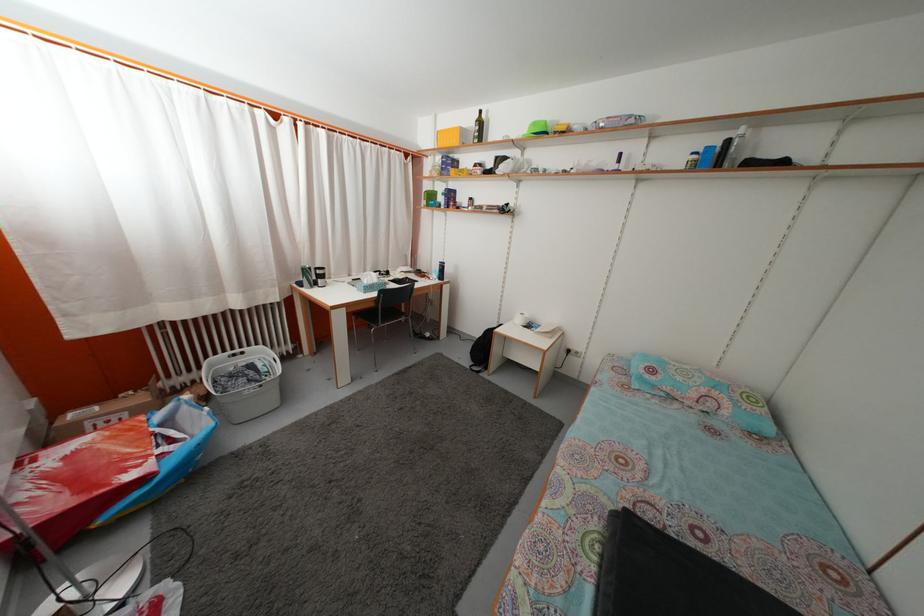
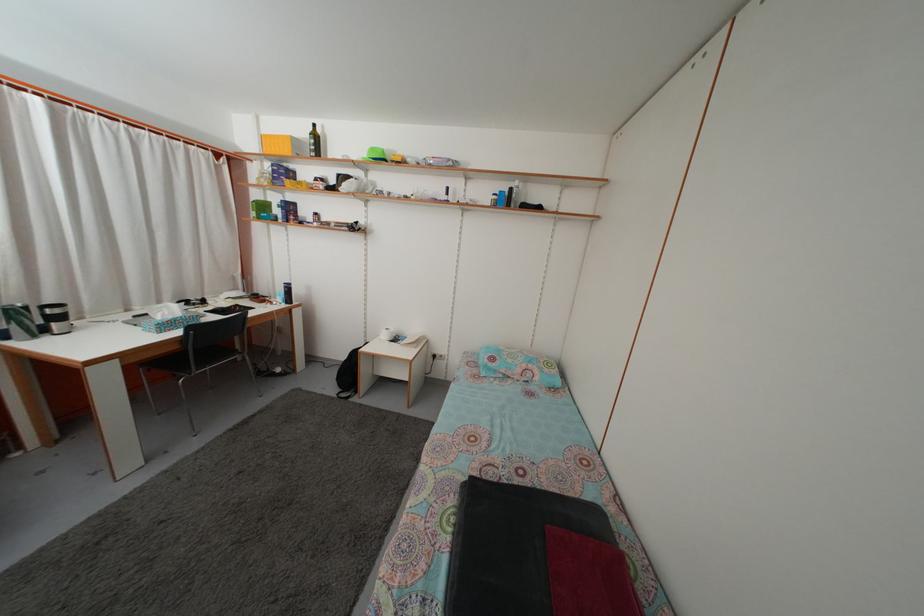
In the scene shown: The images are taken continuously from a first-person perspective. In which direction are you moving?

The cameraman walked toward right, backward.